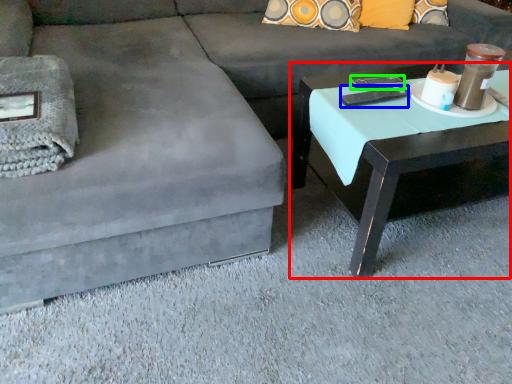
Question: Estimate the real-world distances between objects in this image. Which object is closer to coffee table (highlighted by a red box), remote (highlighted by a blue box) or remote (highlighted by a green box)?

Choices:
 (A) remote
 (B) remote

Answer: (A)